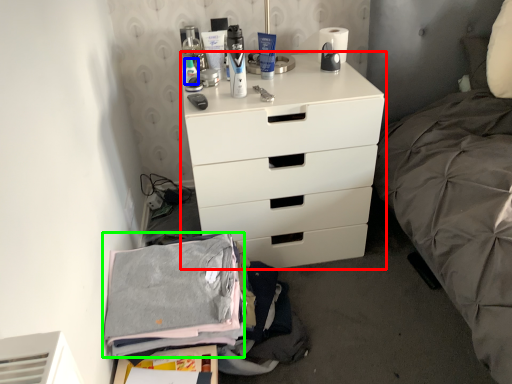
Question: Estimate the real-world distances between objects in this image. Which object is closer to chest of drawers (highlighted by a red box), toiletry (highlighted by a blue box) or clothing (highlighted by a green box)?

Choices:
 (A) toiletry
 (B) clothing

Answer: (B)